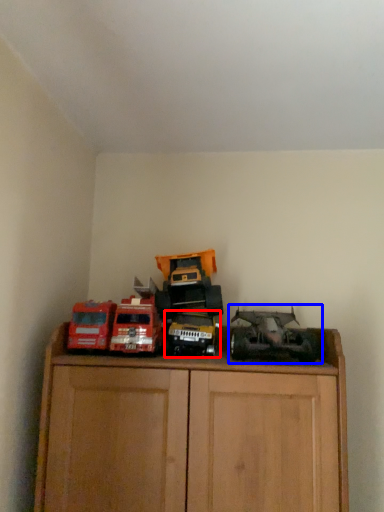
Question: Which object is closer to the camera taking this photo, toy (highlighted by a red box) or toy (highlighted by a blue box)?

Choices:
 (A) toy
 (B) toy

Answer: (B)